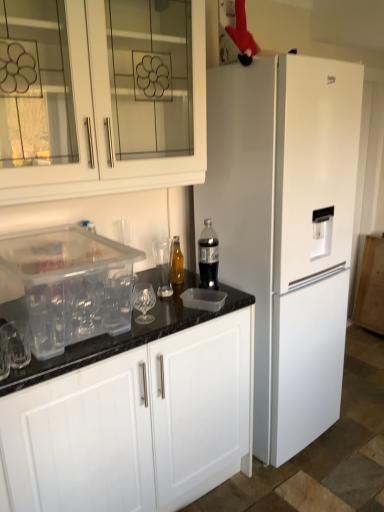
Question: Is translucent plastic bottle at center, which is the 2th bottle from back to front, positioned with its back to translucent glass bottle at center, marked as the first bottle in a left-to-right arrangement?

Choices:
 (A) yes
 (B) no

Answer: (A)

Question: Is translucent plastic bottle at center, which is the 2th bottle from back to front, next to translucent glass bottle at center, the second bottle in the front-to-back sequence, and touching it?

Choices:
 (A) yes
 (B) no

Answer: (B)

Question: From the image's perspective, is translucent plastic bottle at center, positioned as the 1th bottle in front-to-back order, beneath translucent glass bottle at center, arranged as the first bottle when viewed from the back?

Choices:
 (A) yes
 (B) no

Answer: (B)

Question: Considering the relative sizes of translucent plastic bottle at center, positioned as the 1th bottle in front-to-back order, and translucent glass bottle at center, the second bottle from the right, in the image provided, is translucent plastic bottle at center, positioned as the 1th bottle in front-to-back order, bigger than translucent glass bottle at center, the second bottle from the right,?

Choices:
 (A) yes
 (B) no

Answer: (A)

Question: Does translucent plastic bottle at center, positioned as the 1th bottle in front-to-back order, come in front of translucent glass bottle at center, marked as the first bottle in a left-to-right arrangement?

Choices:
 (A) no
 (B) yes

Answer: (B)

Question: Considering the positions of point (208, 224) and point (200, 123), is point (208, 224) closer or farther from the camera than point (200, 123)?

Choices:
 (A) closer
 (B) farther

Answer: (B)

Question: From a real-world perspective, is translucent plastic bottle at center, arranged as the 2th bottle when viewed from the left, physically located above or below white glass cabinet at upper left, which is counted as the 2th cabinetry, starting from the bottom?

Choices:
 (A) below
 (B) above

Answer: (A)

Question: Is translucent plastic bottle at center, positioned as the 1th bottle in front-to-back order, inside the boundaries of white glass cabinet at upper left, arranged as the first cabinetry when viewed from the top, or outside?

Choices:
 (A) inside
 (B) outside

Answer: (B)

Question: Relative to white glass cabinet at upper left, which is counted as the 2th cabinetry, starting from the bottom, is translucent plastic bottle at center, which is the 2th bottle from back to front, in front or behind?

Choices:
 (A) front
 (B) behind

Answer: (B)

Question: From a real-world perspective, relative to white glass cabinet at upper left, arranged as the first cabinetry when viewed from the top, is translucent glass bottle at center, arranged as the first bottle when viewed from the back, vertically above or below?

Choices:
 (A) above
 (B) below

Answer: (B)

Question: Considering their positions, is translucent glass bottle at center, marked as the first bottle in a left-to-right arrangement, located in front of or behind white glass cabinet at upper left, arranged as the first cabinetry when viewed from the top?

Choices:
 (A) behind
 (B) front

Answer: (A)

Question: From the image's perspective, is translucent glass bottle at center, marked as the first bottle in a left-to-right arrangement, above or below white glass cabinet at upper left, which is counted as the 2th cabinetry, starting from the bottom?

Choices:
 (A) below
 (B) above

Answer: (A)

Question: Is translucent glass bottle at center, marked as the first bottle in a left-to-right arrangement, wider or thinner than white glass cabinet at upper left, which is counted as the 2th cabinetry, starting from the bottom?

Choices:
 (A) wide
 (B) thin

Answer: (B)

Question: Based on their positions, is clear plastic container at lower left, the 1th cabinetry ordered from the bottom, located to the left or right of transparent plastic container at lower left?

Choices:
 (A) right
 (B) left

Answer: (A)

Question: Considering the positions of clear plastic container at lower left, the 2th cabinetry when ordered from top to bottom, and transparent plastic container at lower left in the image, is clear plastic container at lower left, the 2th cabinetry when ordered from top to bottom, wider or thinner than transparent plastic container at lower left?

Choices:
 (A) wide
 (B) thin

Answer: (A)